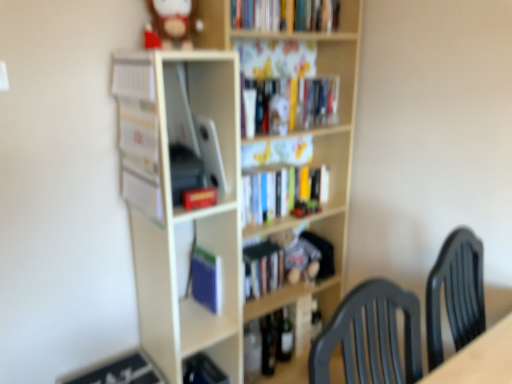
Question: Considering the relative positions of white paper at left, which appears as the fourth book when ordered from the bottom, and matte black book at lower left, placed as the first book when sorted from bottom to top, in the image provided, is white paper at left, which appears as the fourth book when ordered from the bottom, to the left or to the right of matte black book at lower left, placed as the first book when sorted from bottom to top,?

Choices:
 (A) left
 (B) right

Answer: (A)

Question: Relative to matte black book at lower left, placed as the 6th book when sorted from top to bottom, is white paper at left, which appears as the fourth book when ordered from the bottom, in front or behind?

Choices:
 (A) front
 (B) behind

Answer: (A)

Question: Considering the real-world distances, which object is farthest from the matte white cabinet at lower left?

Choices:
 (A) wooden bookcase at center
 (B) white paper at left, the third book from the top
 (C) white matte bookshelf at center, the first shelf when ordered from left to right
 (D) hardcover books at upper center, which appears as the first book when viewed from the top
 (E) blue matte paperback book at center

Answer: (D)

Question: Which of these objects is positioned farthest from the white matte bookshelf at center, the first shelf when ordered from left to right?

Choices:
 (A) hardcover book at center, the 2th book viewed from the top
 (B) wooden bookshelf at center, which is the 2th shelf from left to right
 (C) matte white cabinet at lower left
 (D) matte black book at lower left, placed as the first book when sorted from bottom to top
 (E) matte red book at center, which is the fourth book in top-to-bottom order

Answer: (D)